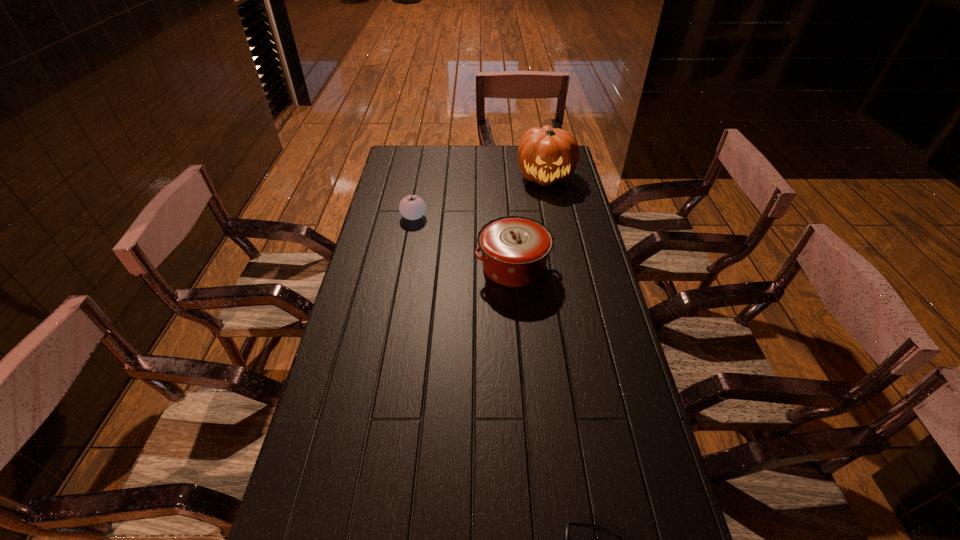
Image resolution: width=960 pixels, height=540 pixels. Identify the location of free space between the tomato and the farthest object. (480, 197).

Locate an element on the screen. vacant space that's between the farthest object and the tomato is located at coordinates (480, 197).

Identify the location of vacant point located between the second tallest object and the second shortest object. Image resolution: width=960 pixels, height=540 pixels. (464, 242).

Locate an element on the screen. empty space that is in between the casserole and the leftmost object is located at coordinates (464, 242).

Identify which object is the third closest to the tallest object. Please provide its 2D coordinates. Your answer should be formatted as a tuple, i.e. [(x, y)], where the tuple contains the x and y coordinates of a point satisfying the conditions above.

[(567, 526)]

Identify the location of the second closest object to the second tallest object. Image resolution: width=960 pixels, height=540 pixels. (546, 155).